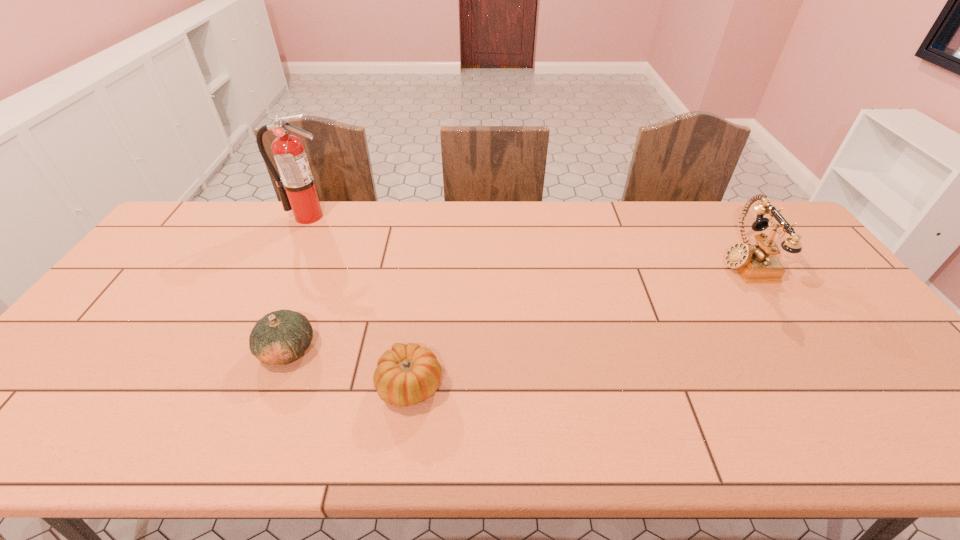
Identify the location of vacant space that satisfies the following two spatial constraints: 1. on the nozzle side of the right gourd; 2. on the left side of the tallest object. (226, 386).

This screenshot has height=540, width=960. I want to click on free location that satisfies the following two spatial constraints: 1. on the front side of the third tallest object; 2. on the right side of the right gourd, so click(274, 386).

At what (x,y) coordinates should I click in order to perform the action: click on free location that satisfies the following two spatial constraints: 1. on the dial number of the rightmost object; 2. on the front side of the taller gourd. Please return your answer as a coordinate pair (x, y). Looking at the image, I should click on (801, 349).